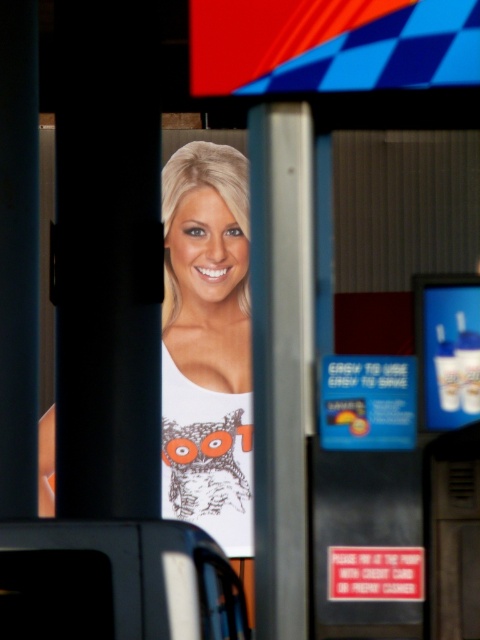
Question: Does white matte tank top at center appear on the right side of metallic silver sign at center?

Choices:
 (A) yes
 (B) no

Answer: (B)

Question: Is blue plastic credit card at center above white glossy cup at right?

Choices:
 (A) yes
 (B) no

Answer: (B)

Question: Among these objects, which one is farthest from the camera?

Choices:
 (A) white matte tank top at center
 (B) white glossy cup at right

Answer: (A)

Question: Can you confirm if blue plastic credit card at center is positioned to the left of white glossy cup at right?

Choices:
 (A) no
 (B) yes

Answer: (B)

Question: Which point is closer to the camera?

Choices:
 (A) metallic silver sign at center
 (B) white glossy cup at right

Answer: (A)

Question: Among these objects, which one is nearest to the camera?

Choices:
 (A) metallic silver sign at center
 (B) blue plastic credit card at center
 (C) metallic silver pillar at center
 (D) white matte tank top at center

Answer: (A)